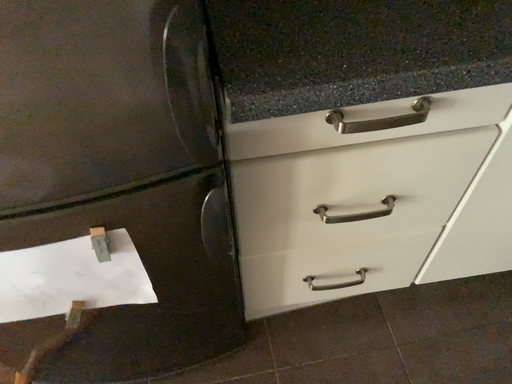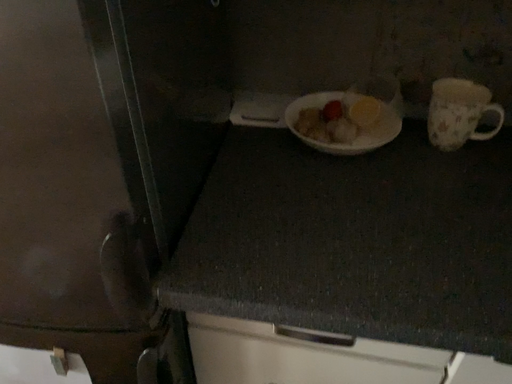
Question: Which way did the camera rotate in the video?

Choices:
 (A) rotated upward
 (B) rotated downward

Answer: (A)